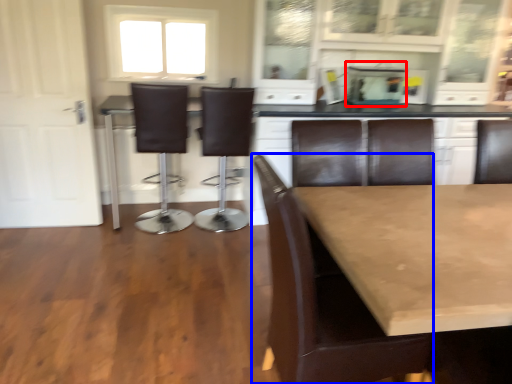
Question: Which point is further to the camera, appliance (highlighted by a red box) or chair (highlighted by a blue box)?

Choices:
 (A) appliance
 (B) chair

Answer: (A)